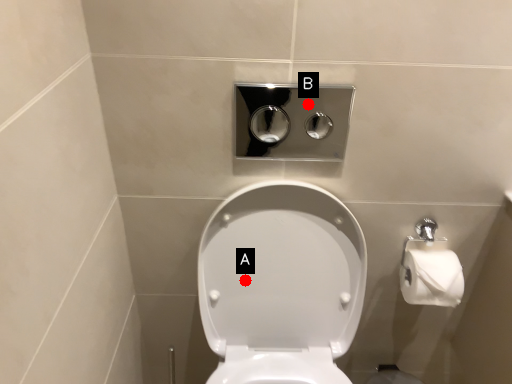
Question: Two points are circled on the image, labeled by A and B beside each circle. Which point appears farthest from the camera in this image?

Choices:
 (A) A is further
 (B) B is further

Answer: (B)